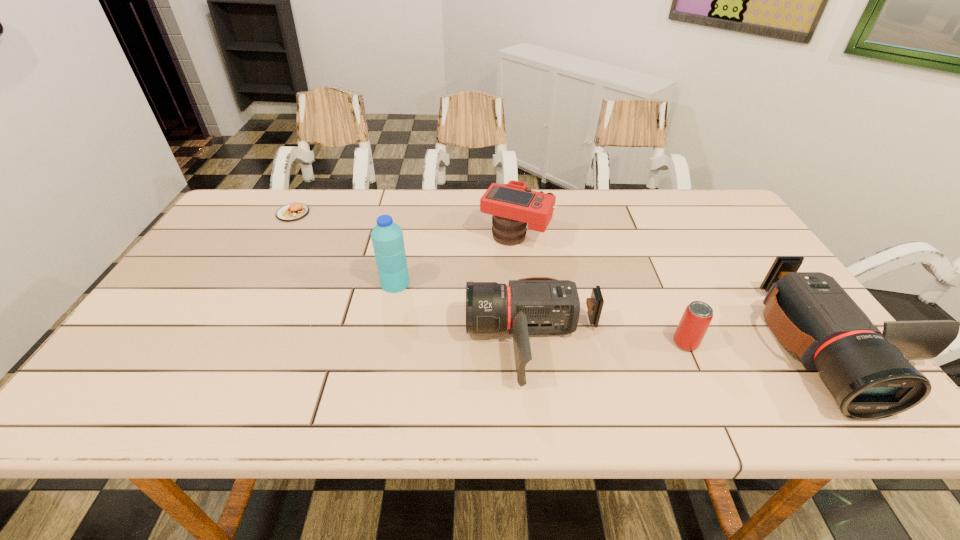
Identify the location of vacant point located 0.220m on the front of the patty. (262, 268).

I want to click on free space located 0.260m on the front of the camera, so click(x=524, y=322).

Locate an element on the screen. The image size is (960, 540). vacant region located on the right of the second object from left to right is located at coordinates (428, 284).

Image resolution: width=960 pixels, height=540 pixels. Find the location of `vacant space located 0.380m on the back of the fifth object from left to right`. vacant space located 0.380m on the back of the fifth object from left to right is located at coordinates pyautogui.click(x=638, y=237).

Locate an element on the screen. patty located at the far edge is located at coordinates (291, 212).

You are a GUI agent. You are given a task and a screenshot of the screen. Output one action in this format:
    pyautogui.click(x=<x>, y=<y>)
    Task: Click on the camera located in the far edge section of the desktop
    This screenshot has height=540, width=960.
    Given the screenshot: What is the action you would take?
    pyautogui.click(x=513, y=205)

Where is `camcorder present at the near edge`? This screenshot has height=540, width=960. camcorder present at the near edge is located at coordinates (536, 305).

This screenshot has height=540, width=960. Find the location of `beer can at the near edge`. beer can at the near edge is located at coordinates (694, 323).

The width and height of the screenshot is (960, 540). What are the coordinates of `object at the left edge` in the screenshot? It's located at (291, 212).

Image resolution: width=960 pixels, height=540 pixels. I want to click on object at the far left corner, so click(291, 212).